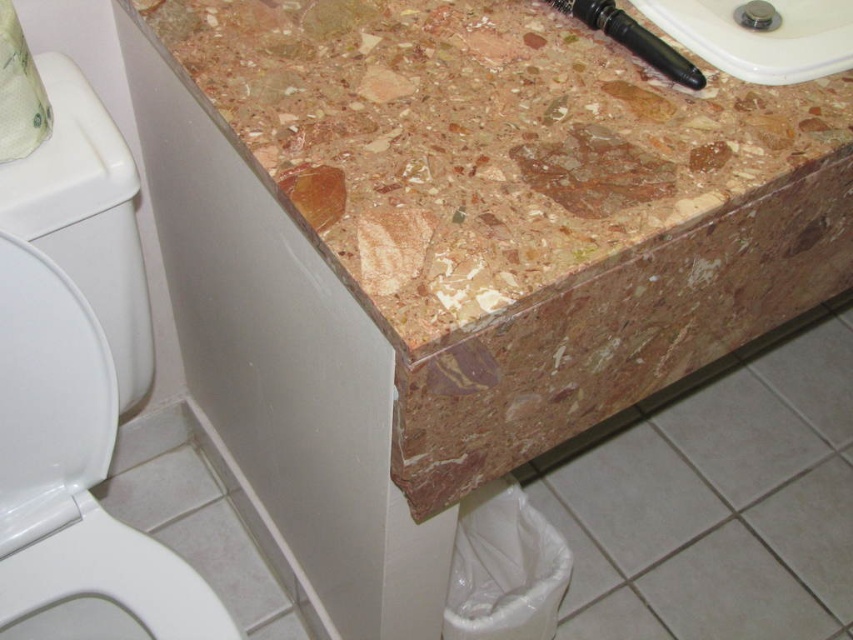
Question: Is matte brown sink at upper right bigger than matte metallic faucet at upper right?

Choices:
 (A) no
 (B) yes

Answer: (B)

Question: Can you confirm if matte brown sink at upper right is wider than white paper towel at upper left?

Choices:
 (A) yes
 (B) no

Answer: (A)

Question: Which point is farther from the camera taking this photo?

Choices:
 (A) (706, 10)
 (B) (79, 292)
 (C) (24, 51)

Answer: (B)

Question: Does white glossy toilet bowl at lower left appear over matte brown sink at upper right?

Choices:
 (A) no
 (B) yes

Answer: (A)

Question: Which of these objects is positioned farthest from the white paper towel at upper left?

Choices:
 (A) matte brown sink at upper right
 (B) matte metallic faucet at upper right
 (C) white glossy toilet bowl at lower left

Answer: (B)

Question: Which of these objects is positioned farthest from the matte brown sink at upper right?

Choices:
 (A) matte metallic faucet at upper right
 (B) white paper towel at upper left
 (C) white glossy toilet bowl at lower left

Answer: (C)